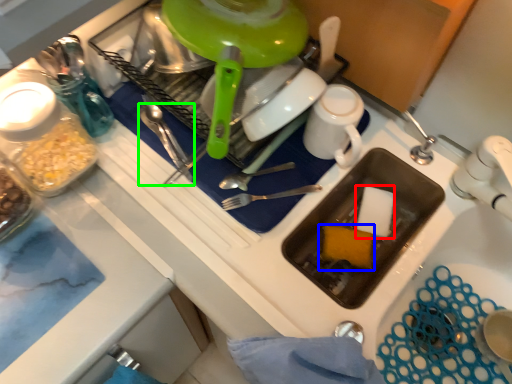
Question: Estimate the real-world distances between objects in this image. Which object is farther from food (highlighted by a red box), food (highlighted by a blue box) or silverware (highlighted by a green box)?

Choices:
 (A) food
 (B) silverware

Answer: (B)